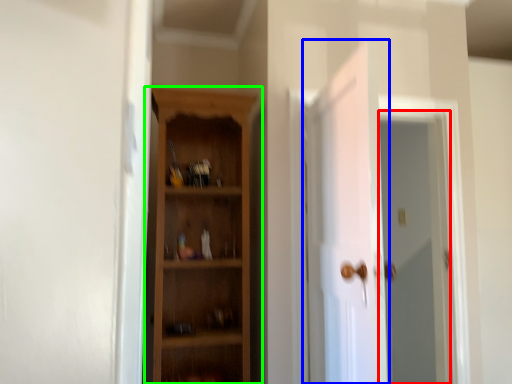
Question: Estimate the real-world distances between objects in this image. Which object is closer to screen door (highlighted by a red box), door (highlighted by a blue box) or cupboard (highlighted by a green box)?

Choices:
 (A) door
 (B) cupboard

Answer: (A)